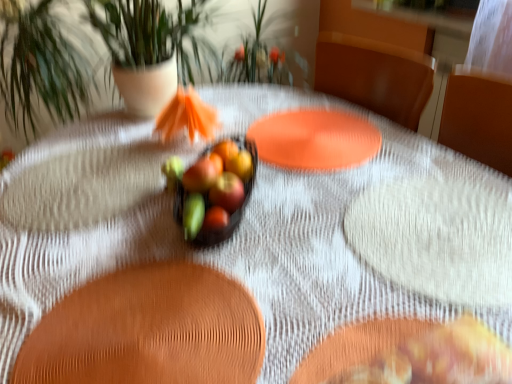
Question: Is glossy apple at center, arranged as the first apple when viewed from the back, taller than green matte flower at center?

Choices:
 (A) no
 (B) yes

Answer: (B)

Question: Can you confirm if glossy apple at center, arranged as the first apple when viewed from the back, is thinner than green matte flower at center?

Choices:
 (A) no
 (B) yes

Answer: (B)

Question: Is glossy apple at center, arranged as the first apple when viewed from the back, to the right of green matte flower at center from the viewer's perspective?

Choices:
 (A) no
 (B) yes

Answer: (B)

Question: Is glossy apple at center, arranged as the first apple when viewed from the back, to the left of green matte flower at center from the viewer's perspective?

Choices:
 (A) no
 (B) yes

Answer: (A)

Question: From a real-world perspective, is glossy apple at center, arranged as the second apple when viewed from the front, on top of green matte flower at center?

Choices:
 (A) no
 (B) yes

Answer: (A)

Question: Looking at their shapes, would you say green matte flower at center is wider or thinner than glossy apple at center, arranged as the second apple when viewed from the front?

Choices:
 (A) thin
 (B) wide

Answer: (B)

Question: Would you say green matte flower at center is to the left or to the right of glossy apple at center, arranged as the first apple when viewed from the back, in the picture?

Choices:
 (A) right
 (B) left

Answer: (B)

Question: Is green matte flower at center spatially inside glossy apple at center, arranged as the second apple when viewed from the front, or outside of it?

Choices:
 (A) outside
 (B) inside

Answer: (A)

Question: Considering the positions of green matte flower at center and glossy apple at center, arranged as the second apple when viewed from the front, in the image, is green matte flower at center bigger or smaller than glossy apple at center, arranged as the second apple when viewed from the front,?

Choices:
 (A) small
 (B) big

Answer: (B)

Question: From a real-world perspective, relative to glossy red apple at center, the first apple in the front-to-back sequence, is glossy apple at center, arranged as the first apple when viewed from the back, vertically above or below?

Choices:
 (A) below
 (B) above

Answer: (A)

Question: Relative to glossy red apple at center, the first apple in the front-to-back sequence, is glossy apple at center, arranged as the first apple when viewed from the back, in front or behind?

Choices:
 (A) behind
 (B) front

Answer: (A)

Question: Is point (238, 162) positioned closer to the camera than point (224, 205)?

Choices:
 (A) closer
 (B) farther

Answer: (B)

Question: Do you think glossy apple at center, arranged as the second apple when viewed from the front, is within glossy red apple at center, the first apple in the front-to-back sequence, or outside of it?

Choices:
 (A) inside
 (B) outside

Answer: (B)

Question: Considering the positions of green matte apple at center, the 1th fruit when ordered from left to right, and glossy glass bowl at center, the first fruit from the top, in the image, is green matte apple at center, the 1th fruit when ordered from left to right, bigger or smaller than glossy glass bowl at center, the first fruit from the top,?

Choices:
 (A) big
 (B) small

Answer: (B)

Question: From a real-world perspective, is green matte apple at center, the 1th fruit when ordered from left to right, positioned above or below glossy glass bowl at center, the 3th fruit when ordered from bottom to top?

Choices:
 (A) below
 (B) above

Answer: (A)